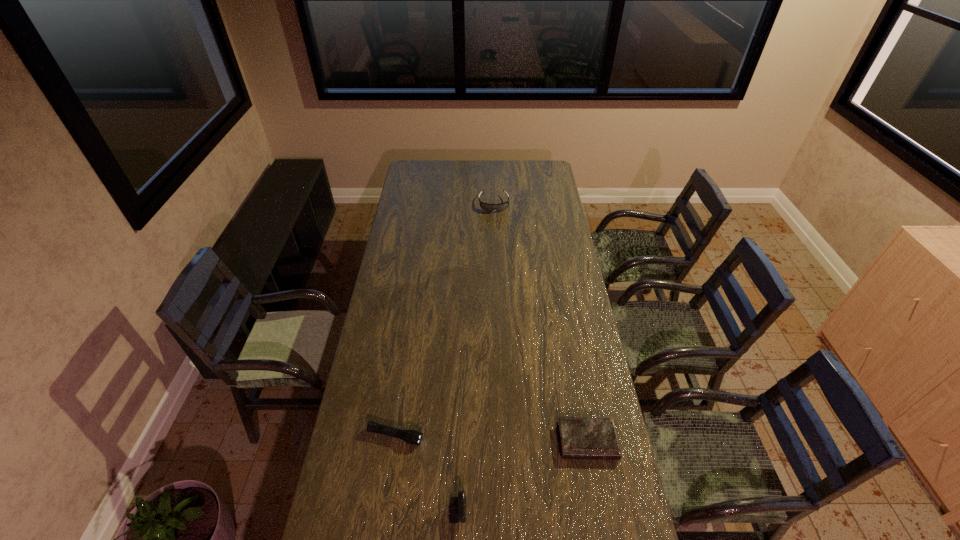
Image resolution: width=960 pixels, height=540 pixels. I want to click on free point located at the lens end of the flashlight, so click(x=475, y=453).

The height and width of the screenshot is (540, 960). In order to click on blank space located 0.110m on the front and sides of the goggles in this screenshot , I will do `click(496, 226)`.

Where is `free space located 0.130m on the front and sides of the goggles`? The image size is (960, 540). free space located 0.130m on the front and sides of the goggles is located at coordinates (496, 228).

You are a GUI agent. You are given a task and a screenshot of the screen. Output one action in this format:
    pyautogui.click(x=<x>, y=<y>)
    Task: Click on the free region located on the front and sides of the goggles
    The height and width of the screenshot is (540, 960).
    Given the screenshot: What is the action you would take?
    pyautogui.click(x=495, y=222)

The width and height of the screenshot is (960, 540). I want to click on object present at the near edge, so click(457, 509).

Where is `webcam at the left edge`? webcam at the left edge is located at coordinates (457, 509).

Locate an element on the screen. flashlight situated at the left edge is located at coordinates (412, 437).

Identify the location of object that is at the right edge. The width and height of the screenshot is (960, 540). (580, 438).

Identify the location of object located at the near left corner. (457, 509).

Where is `vacant area at the near edge of the desktop`? Image resolution: width=960 pixels, height=540 pixels. vacant area at the near edge of the desktop is located at coordinates (559, 511).